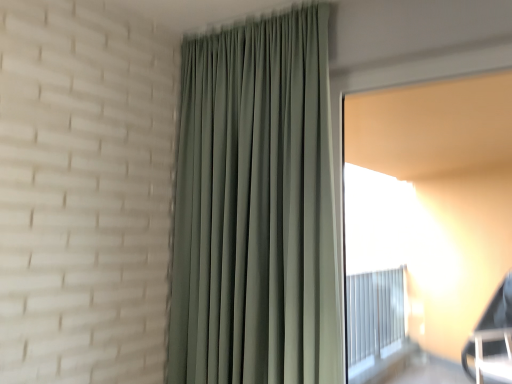
The image size is (512, 384). What do you see at coordinates (255, 208) in the screenshot? I see `sage green fabric curtain at center` at bounding box center [255, 208].

The height and width of the screenshot is (384, 512). I want to click on sage green fabric curtain at center, so click(x=255, y=208).

In order to click on white matte window screen at right in this screenshot , I will do `click(433, 195)`.

What do you see at coordinates (433, 195) in the screenshot? The height and width of the screenshot is (384, 512). I see `white matte window screen at right` at bounding box center [433, 195].

The image size is (512, 384). I want to click on sage green fabric curtain at center, so click(255, 208).

Looking at this image, which object is positioned more to the right, white matte window screen at right or sage green fabric curtain at center?

white matte window screen at right is more to the right.

Which object is further away from the camera, white matte window screen at right or sage green fabric curtain at center?

sage green fabric curtain at center is more distant.

Which is further, (442, 155) or (259, 263)?

The point (442, 155) is behind.

From the image's perspective, is white matte window screen at right located above or below sage green fabric curtain at center?

Clearly, from the image's perspective, white matte window screen at right is below sage green fabric curtain at center.

From a real-world perspective, which object stands above the other?

sage green fabric curtain at center.

In terms of width, does white matte window screen at right look wider or thinner when compared to sage green fabric curtain at center?

white matte window screen at right is thinner than sage green fabric curtain at center.

From their relative heights in the image, would you say white matte window screen at right is taller or shorter than sage green fabric curtain at center?

Considering their sizes, white matte window screen at right has less height than sage green fabric curtain at center.

Based on their sizes in the image, would you say white matte window screen at right is bigger or smaller than sage green fabric curtain at center?

In the image, white matte window screen at right appears to be smaller than sage green fabric curtain at center.

Can we say white matte window screen at right lies outside sage green fabric curtain at center?

white matte window screen at right lies outside sage green fabric curtain at center's area.

Does white matte window screen at right touch sage green fabric curtain at center?

No, white matte window screen at right is not beside sage green fabric curtain at center.

Is sage green fabric curtain at center at the back of white matte window screen at right?

No, white matte window screen at right is not facing the opposite direction of sage green fabric curtain at center.

What's the angular difference between white matte window screen at right and sage green fabric curtain at center's facing directions?

0.631 degrees.

I want to click on curtain to the left of white matte window screen at right, so [255, 208].

Which object is positioned more to the left, sage green fabric curtain at center or white matte window screen at right?

sage green fabric curtain at center is more to the left.

In the image, is sage green fabric curtain at center positioned in front of or behind white matte window screen at right?

Visually, sage green fabric curtain at center is located behind white matte window screen at right.

Does point (258, 304) come farther from viewer compared to point (424, 259)?

No.

From the image's perspective, who appears lower, sage green fabric curtain at center or white matte window screen at right?

white matte window screen at right appears lower in the image.

From a real-world perspective, is sage green fabric curtain at center on top of white matte window screen at right?

Correct, in the physical world, sage green fabric curtain at center is higher than white matte window screen at right.

Consider the image. Does sage green fabric curtain at center have a greater width compared to white matte window screen at right?

Indeed, sage green fabric curtain at center has a greater width compared to white matte window screen at right.

Is sage green fabric curtain at center taller or shorter than white matte window screen at right?

Clearly, sage green fabric curtain at center is taller compared to white matte window screen at right.

Based on the photo, between sage green fabric curtain at center and white matte window screen at right, which one has smaller size?

With smaller size is white matte window screen at right.

Can we say sage green fabric curtain at center lies outside white matte window screen at right?

Yes, sage green fabric curtain at center is located beyond the bounds of white matte window screen at right.

Is sage green fabric curtain at center far away from white matte window screen at right?

Indeed, sage green fabric curtain at center is not near white matte window screen at right.

Is sage green fabric curtain at center turned away from white matte window screen at right?

sage green fabric curtain at center is not turned away from white matte window screen at right.

How many degrees apart are the facing directions of sage green fabric curtain at center and white matte window screen at right?

0.631 degrees.

How far apart are sage green fabric curtain at center and white matte window screen at right?

A distance of 6.10 feet exists between sage green fabric curtain at center and white matte window screen at right.

Where is `window screen in front of the sage green fabric curtain at center`? Image resolution: width=512 pixels, height=384 pixels. window screen in front of the sage green fabric curtain at center is located at coordinates (433, 195).

This screenshot has height=384, width=512. I want to click on window screen located underneath the sage green fabric curtain at center (from a real-world perspective), so click(433, 195).

Where is `curtain above the white matte window screen at right (from a real-world perspective)`? curtain above the white matte window screen at right (from a real-world perspective) is located at coordinates (255, 208).